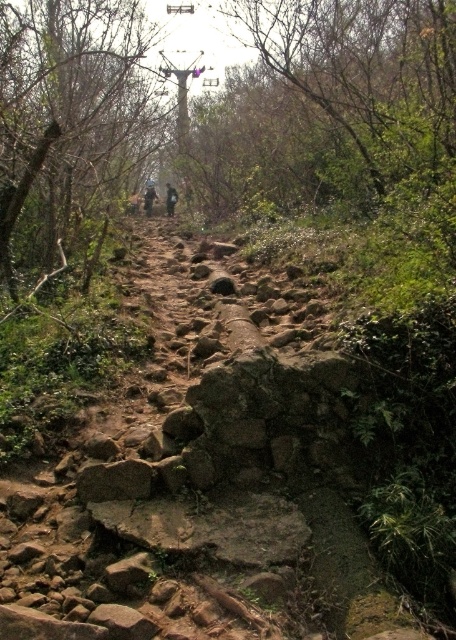
You are a hiker who has just finished a long trek and needs to decide where to place your dark gray fabric jacket at center for visibility. Considering the brown rough tree at upper left is nearby, which object should you use as a reference point for placement?

The brown rough tree at upper left is larger in size than the dark gray fabric jacket at center, so it would make a better reference point for placement to ensure visibility.

You are a hiker carrying a backpack and see the brown rough tree at upper left and the dark gray fabric jacket at center in the forest. Which object is wider?

The brown rough tree at upper left might be wider than the dark gray fabric jacket at center.

You are a hiker carrying a dark brown leather backpack at center and want to take a photo of the brown rough tree at upper left. Since the tree is larger, how should you position yourself to capture it fully in the frame?

The brown rough tree at upper left is larger than the dark brown leather backpack at center. To capture the entire tree in the frame, you should move further away from the tree while keeping the backpack in view, ensuring both are included in the photo.